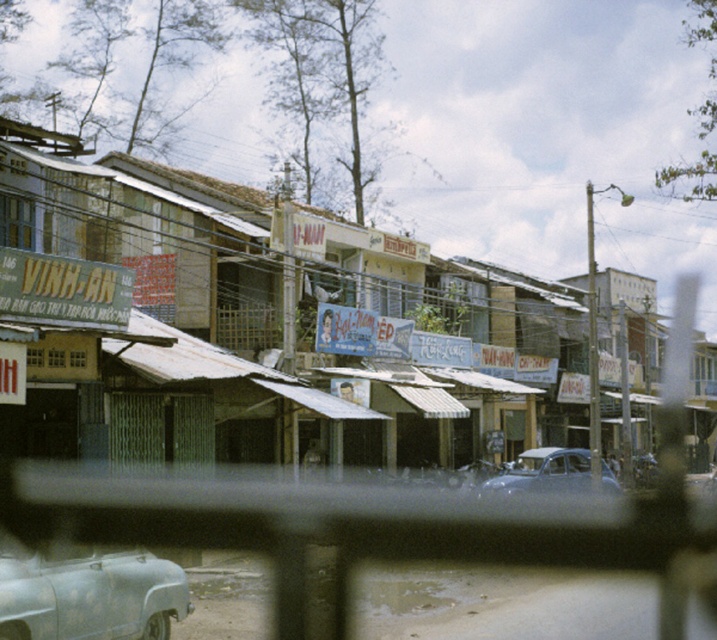
Can you confirm if rusty metallic car at lower left is taller than matte gray car at center?

Yes.

What do you see at coordinates (87, 593) in the screenshot? I see `rusty metallic car at lower left` at bounding box center [87, 593].

Where is `rusty metallic car at lower left`? This screenshot has width=717, height=640. rusty metallic car at lower left is located at coordinates (87, 593).

Consider the image. Which is above, rusty metal signboard at center or rusty metallic car at lower left?

rusty metal signboard at center is above.

Who is more distant from viewer, (617, 282) or (125, 596)?

The point (617, 282) is more distant.

The image size is (717, 640). What are the coordinates of `rusty metal signboard at center` in the screenshot? It's located at (265, 324).

At what (x,y) coordinates should I click in order to perform the action: click on rusty metal signboard at center. Please return your answer as a coordinate pair (x, y). The width and height of the screenshot is (717, 640). Looking at the image, I should click on (265, 324).

The image size is (717, 640). Identify the location of rusty metal signboard at center. (265, 324).

In order to click on rusty metal signboard at center in this screenshot , I will do `click(265, 324)`.